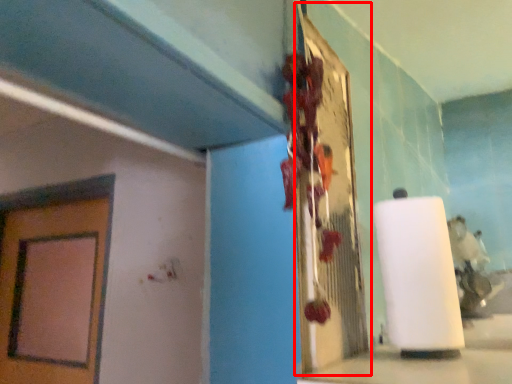
Question: From the image's perspective, what is the correct spatial relationship of bulletin board (annotated by the red box) in relation to paper towel?

Choices:
 (A) above
 (B) below

Answer: (A)